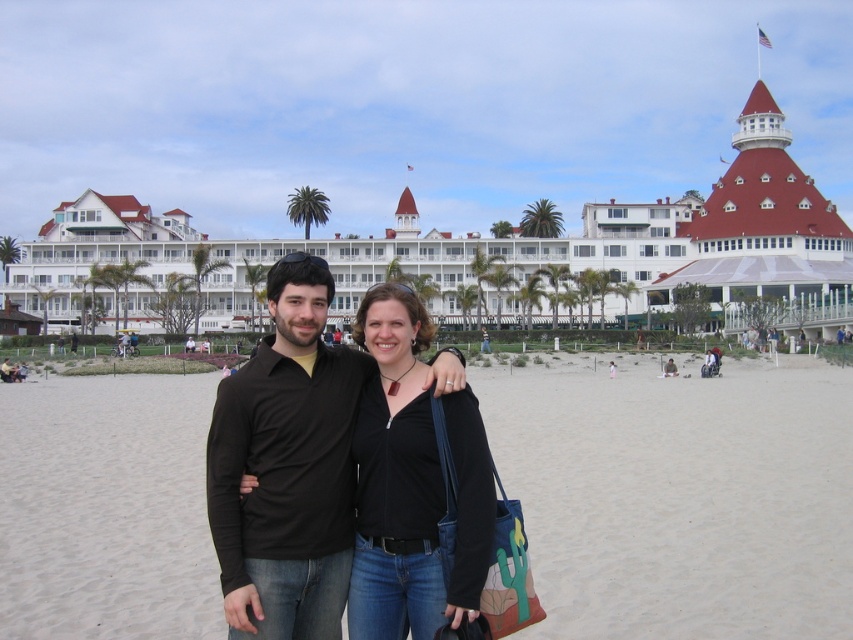
Question: Which point is closer to the camera?

Choices:
 (A) white sand at center
 (B) black matte shirt at center
 (C) black matte jacket at center

Answer: (B)

Question: Where is white sand at center located in relation to black matte jacket at center in the image?

Choices:
 (A) below
 (B) above

Answer: (A)

Question: Is white sand at center thinner than black matte jacket at center?

Choices:
 (A) no
 (B) yes

Answer: (A)

Question: Among these objects, which one is farthest from the camera?

Choices:
 (A) black matte jacket at center
 (B) black matte shirt at center
 (C) white sand at center

Answer: (C)

Question: Which object is the closest to the black matte jacket at center?

Choices:
 (A) black matte shirt at center
 (B) white sand at center

Answer: (A)

Question: Does white sand at center appear on the left side of black matte shirt at center?

Choices:
 (A) yes
 (B) no

Answer: (B)